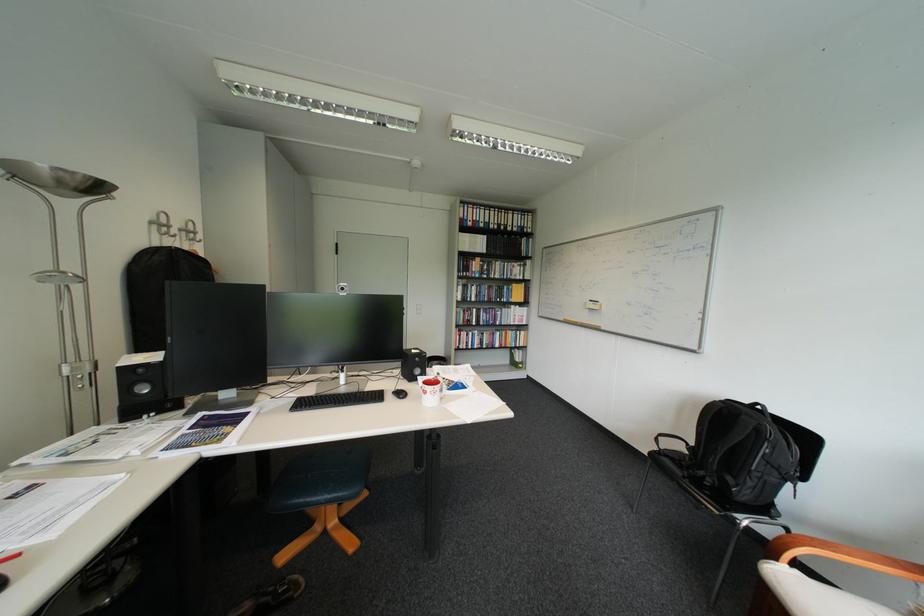
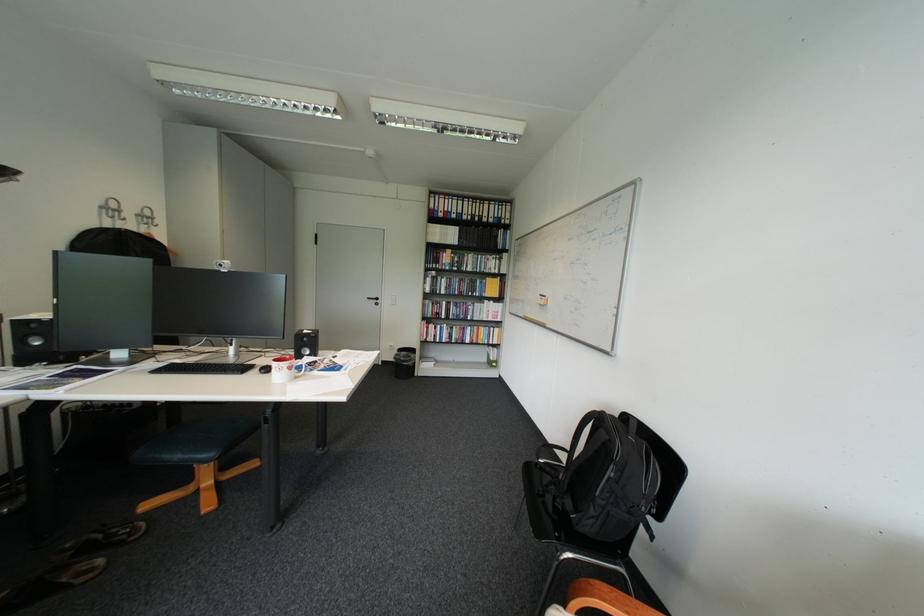
The point at (504, 224) is marked in the first image. Where is the corresponding point in the second image?

(477, 215)